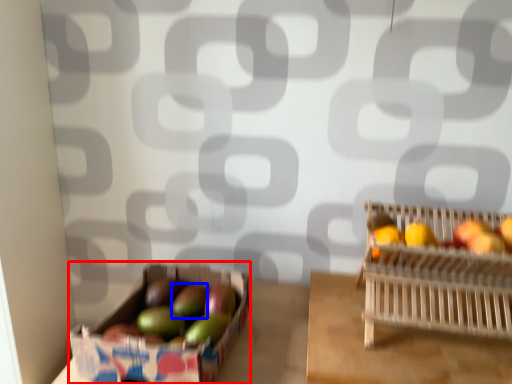
Question: Which object appears closest to the camera in this image, cardboard box (highlighted by a red box) or apple (highlighted by a blue box)?

Choices:
 (A) cardboard box
 (B) apple

Answer: (A)